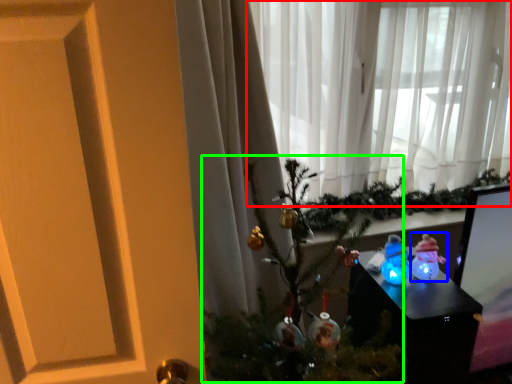
Question: Which object is positioned farthest from curtain (highlighted by a red box)? Select from toy (highlighted by a blue box) and christmas tree (highlighted by a green box).

Choices:
 (A) toy
 (B) christmas tree

Answer: (A)